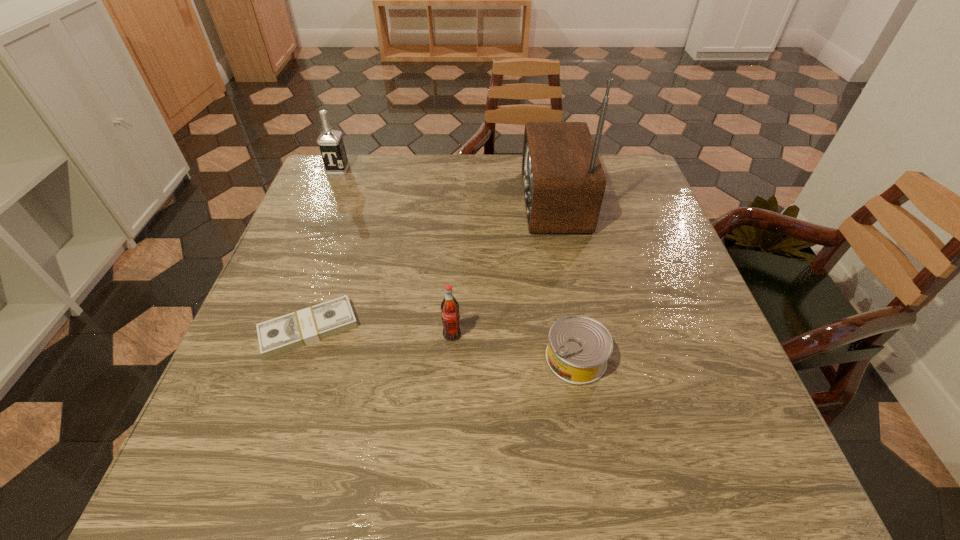
Where is `vacant space at the left edge of the desktop`? The height and width of the screenshot is (540, 960). vacant space at the left edge of the desktop is located at coordinates (269, 381).

In the image, there is a desktop. At what (x,y) coordinates should I click in order to perform the action: click on vacant area at the right edge. Please return your answer as a coordinate pair (x, y). This screenshot has height=540, width=960. Looking at the image, I should click on (705, 353).

The image size is (960, 540). I want to click on free space at the near left corner of the desktop, so click(211, 458).

In order to click on blank space at the far right corner of the desktop in this screenshot , I will do `click(626, 188)`.

Find the location of a particular element. The width and height of the screenshot is (960, 540). empty space between the soda bottle and the can is located at coordinates click(x=514, y=347).

Image resolution: width=960 pixels, height=540 pixels. In order to click on unoccupied area between the tallest object and the shortest object in this screenshot , I will do `click(430, 265)`.

I want to click on vacant area that lies between the can and the vodka, so click(x=457, y=265).

Locate an element on the screen. This screenshot has width=960, height=540. free space between the radio receiver and the fourth tallest object is located at coordinates (564, 280).

Identify the location of empty location between the dollar and the can. (443, 343).

Locate an element on the screen. Image resolution: width=960 pixels, height=540 pixels. free space between the tallest object and the third object from left to right is located at coordinates (502, 268).